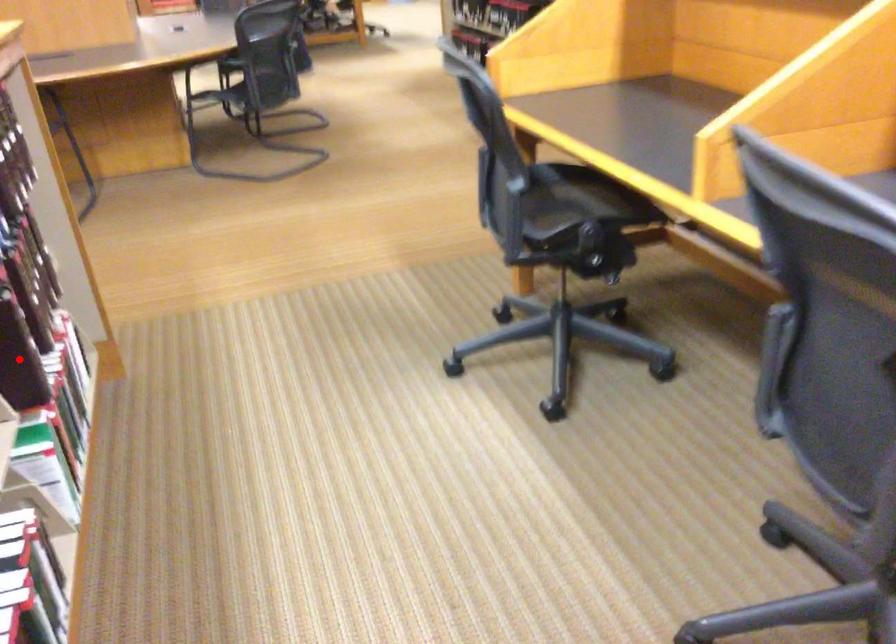
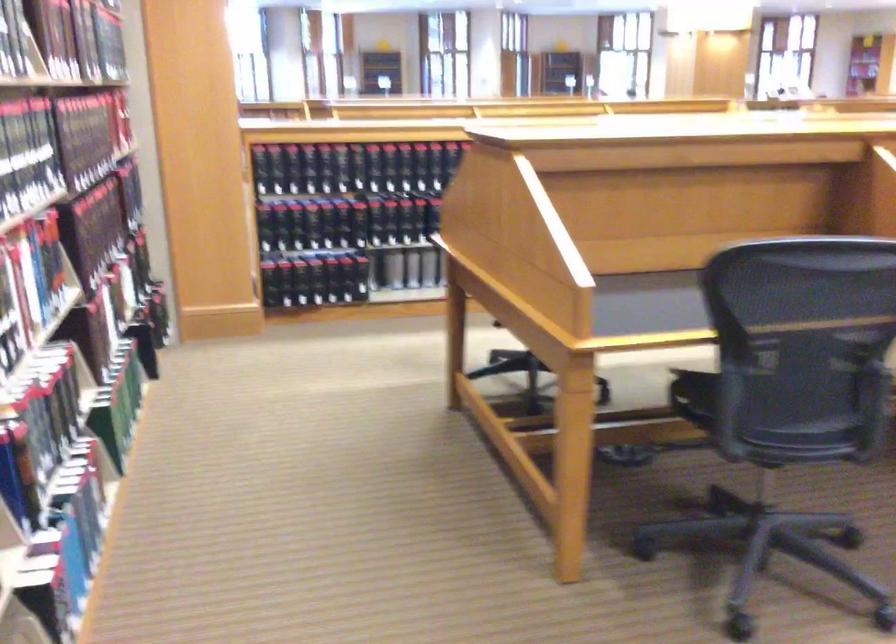
Question: I am providing you with two images of the same scene from different viewpoints. A red point is marked on the first image. At the location where the point appears in image 1, is it still visible in image 2?

Choices:
 (A) Yes
 (B) No

Answer: (B)